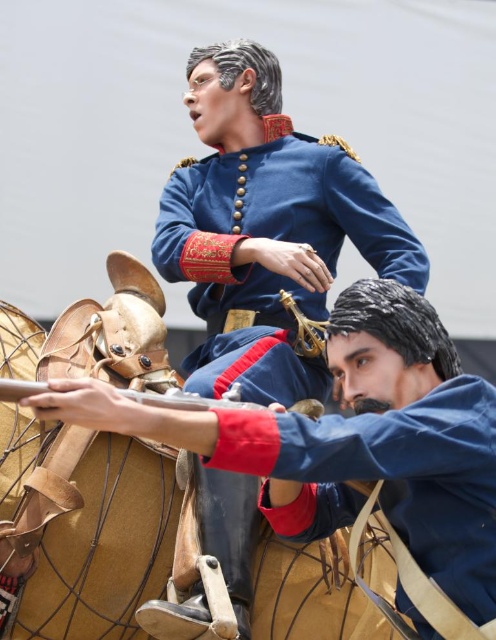
You are a GUI agent. You are given a task and a screenshot of the screen. Output one action in this format:
    pyautogui.click(x=<x>, y=<y>)
    Task: Click on the blue satin uniform at center
    
    Given the screenshot: What is the action you would take?
    pyautogui.click(x=273, y=240)

Who is positioned more to the left, blue satin uniform at center or metallic gun at center?

metallic gun at center

The height and width of the screenshot is (640, 496). I want to click on blue satin uniform at center, so click(273, 240).

Who is taller, matte blue uniform at center or blue satin uniform at center?

Standing taller between the two is blue satin uniform at center.

From the picture: How far apart are matte blue uniform at center and blue satin uniform at center?

matte blue uniform at center is 34.80 feet away from blue satin uniform at center.

Image resolution: width=496 pixels, height=640 pixels. Describe the element at coordinates (354, 440) in the screenshot. I see `matte blue uniform at center` at that location.

I want to click on matte blue uniform at center, so click(354, 440).

Is point (409, 492) farther from viewer compared to point (138, 403)?

Yes, point (409, 492) is behind point (138, 403).

The height and width of the screenshot is (640, 496). What do you see at coordinates (354, 440) in the screenshot?
I see `matte blue uniform at center` at bounding box center [354, 440].

Image resolution: width=496 pixels, height=640 pixels. I want to click on matte blue uniform at center, so click(x=354, y=440).